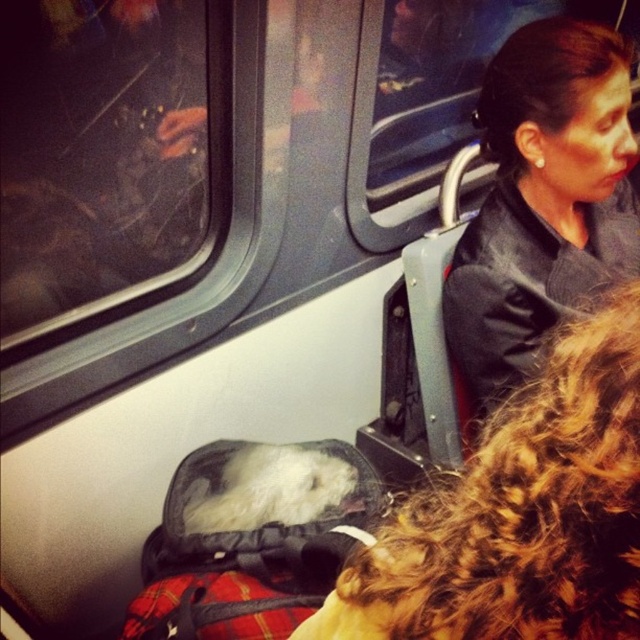
You are a passenger on a train and you see two jackets hanging on the back of seats at the upper right corner of the scene. The jackets are labeled as the smooth black jacket at upper right and the black leather jacket at upper right. Which jacket is shorter in height?

The smooth black jacket at upper right has a lesser height compared to the black leather jacket at upper right, so the smooth black jacket at upper right is shorter in height.

You are a passenger on a train and you see two jackets at the upper right corner of the scene. Which jacket is nearer to you, the smooth black jacket at upper right or the black leather jacket at upper right?

The smooth black jacket at upper right is closer to the viewer than the black leather jacket at upper right, so the smooth black jacket at upper right is nearer to you.